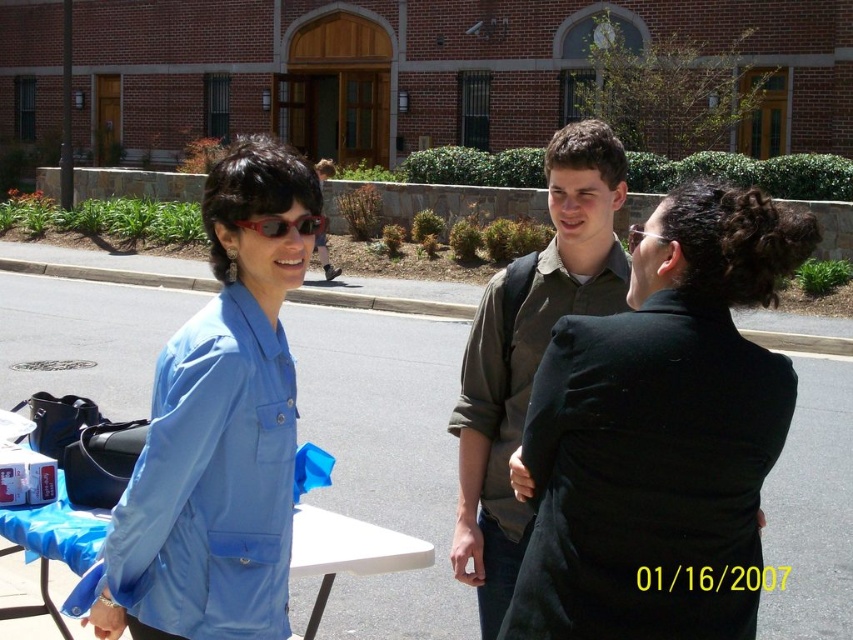
Question: Among these points, which one is nearest to the camera?

Choices:
 (A) tap(288, 227)
 (B) tap(389, 566)

Answer: (A)

Question: In this image, where is matte blue shirt at left located relative to matte green shirt at center?

Choices:
 (A) above
 (B) below

Answer: (A)

Question: Among these objects, which one is farthest from the camera?

Choices:
 (A) matte blue shirt at left
 (B) black matte jacket at center
 (C) matte green shirt at center
 (D) blue fabric picnic table at lower left

Answer: (C)

Question: Does blue fabric picnic table at lower left have a larger size compared to matte black sunglasses at upper center?

Choices:
 (A) yes
 (B) no

Answer: (B)

Question: Which point appears closest to the camera in this image?

Choices:
 (A) (519, 528)
 (B) (705, 452)

Answer: (B)

Question: Is matte green shirt at center thinner than matte black sunglasses at upper center?

Choices:
 (A) yes
 (B) no

Answer: (A)